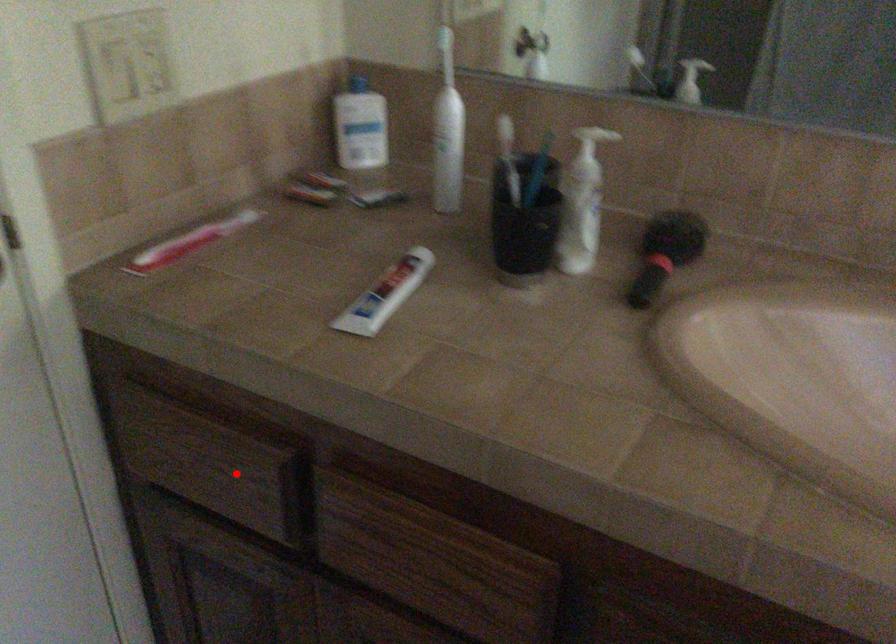
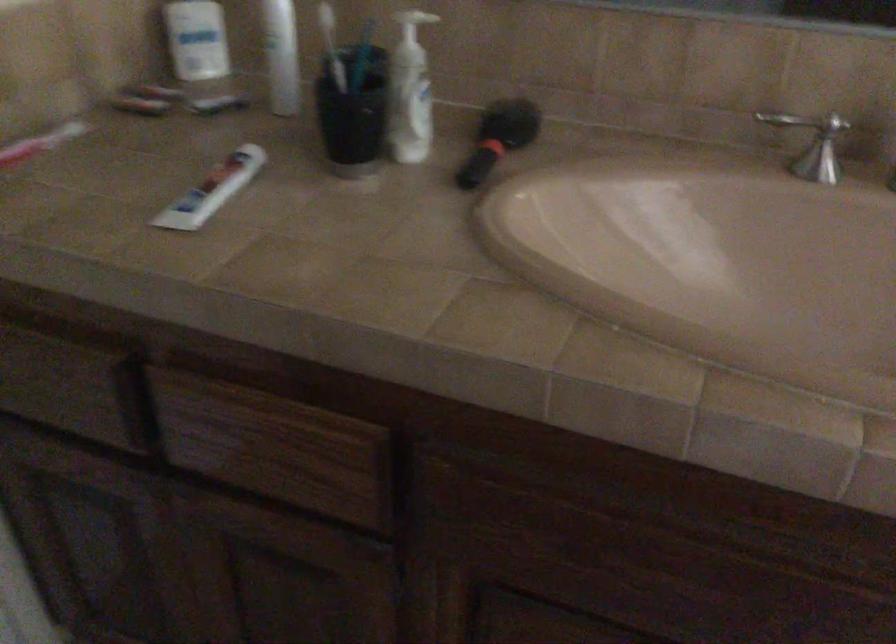
Locate, in the second image, the point that corresponds to the highlighted location in the first image.

(74, 388)